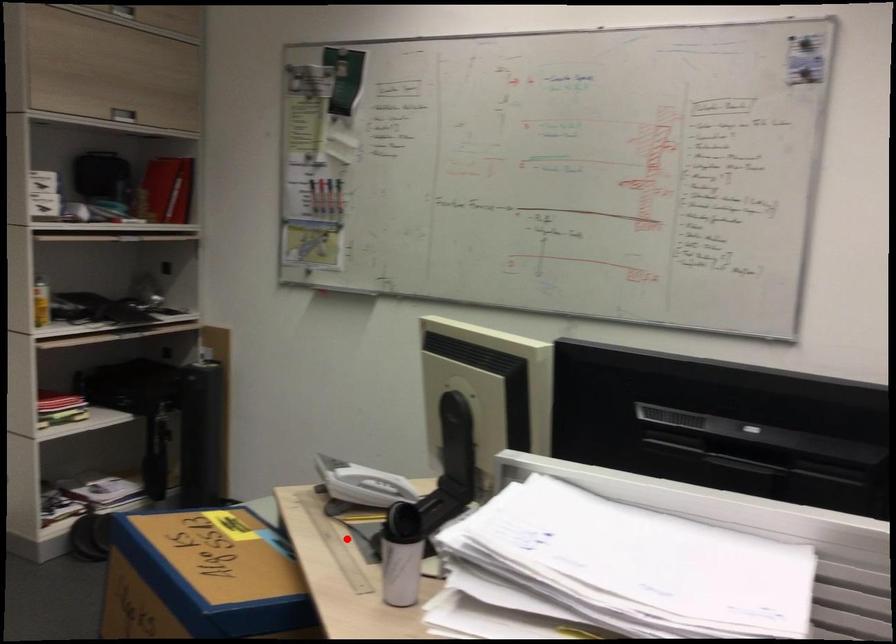
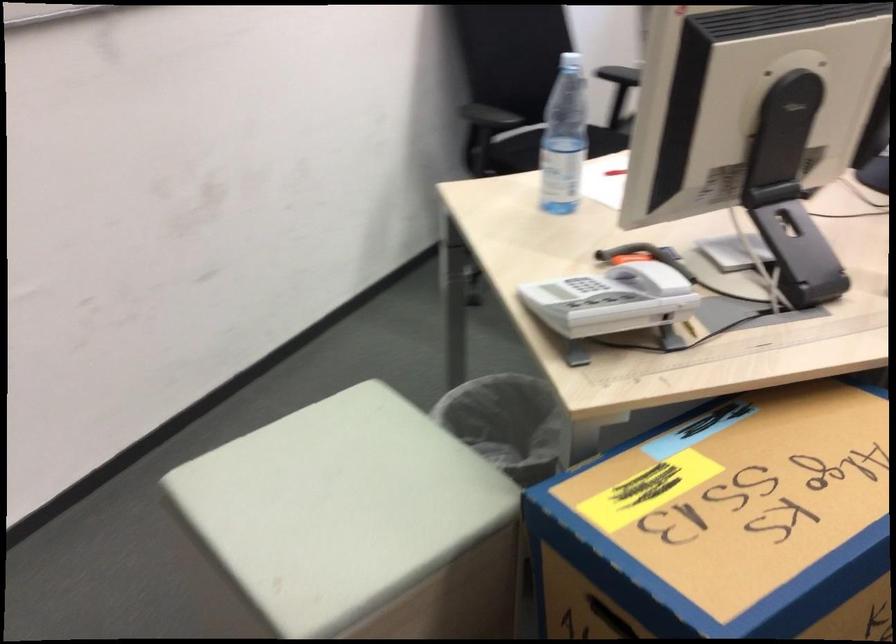
Question: A red point is marked in image1. In image2, is the corresponding 3D point closer to the camera or farther? Reply with the corresponding letter.

Choices:
 (A) The corresponding 3D point is closer.
 (B) The corresponding 3D point is farther.

Answer: (A)